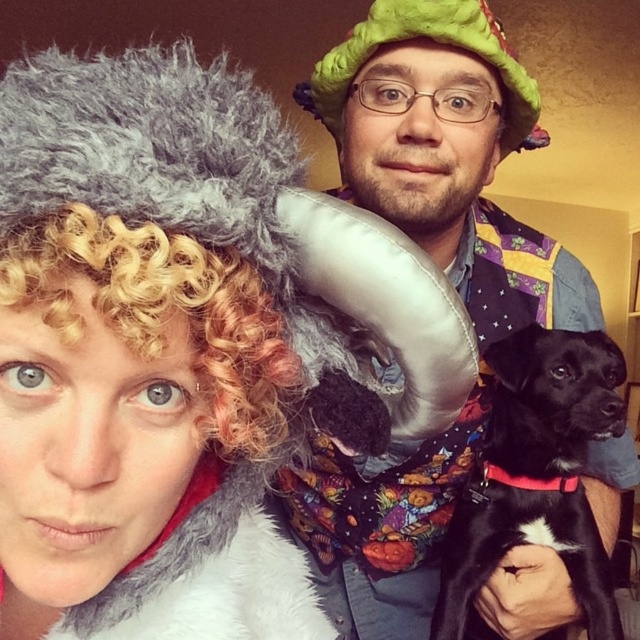
You are standing in front of the scene and want to determine which of the two points, point (429,588) or point (566,470), is closer to you. Based on the spatial arrangement, which point is nearer?

Point (429,588) is further to the viewer than point (566,470), so the closer point to you is point (566,470).

You are a photographer trying to capture a group photo of the fluffy gray wig at upper left and the black smooth dog at center. Since you want to ensure both subjects are clearly visible, which one should you focus on first to account for their size difference?

The fluffy gray wig at upper left is bigger than the black smooth dog at center, so you should focus on the fluffy gray wig at upper left first to ensure its details are sharp, then adjust for the smaller black smooth dog at center.